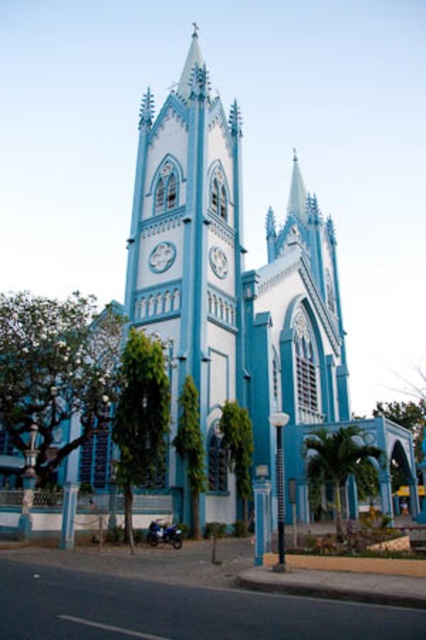
You are standing on the sidewalk in front of the church. You see the blue painted stone tower at center and the metallic silver clock at center. Which object is positioned to the right of the other?

The blue painted stone tower at center is to the right of the metallic silver clock at center.

You are standing on the sidewalk in front of the church. You see the blue painted stone tower at center and the white glossy clock at center. Which one is positioned to the left?

The blue painted stone tower at center is positioned to the left of the white glossy clock at center.